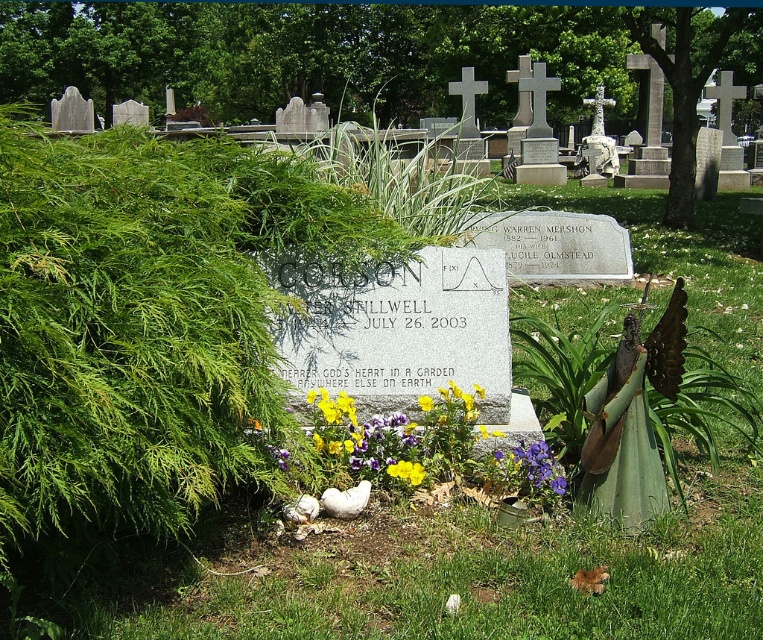
You are standing in a cemetery and see the white stone cross at center. If you want to take a photo of it from a distance where it appears small but still recognizable, which of the following distances would be appropriate? A. 50 feet B. 80 feet C. 100 feet

The white stone cross at center is 88.21 feet away from the viewer. To capture it small but recognizable, 80 feet is closest to the actual distance, so the best choice is B.

You are standing at the center of the cemetery and want to place a bouquet of flowers at the base of the white stone cross at center. Based on the coordinates provided, can you determine the exact location to place the bouquet?

The white stone cross at center is located at coordinates point (597, 140), so you should place the bouquet at the base of the white stone cross at center at those coordinates.

You are standing in a cemetery and see the green leafy bush at left and the purple matte flower at center. Which one is positioned more to the left side?

The green leafy bush at left is positioned more to the left side than the purple matte flower at center.